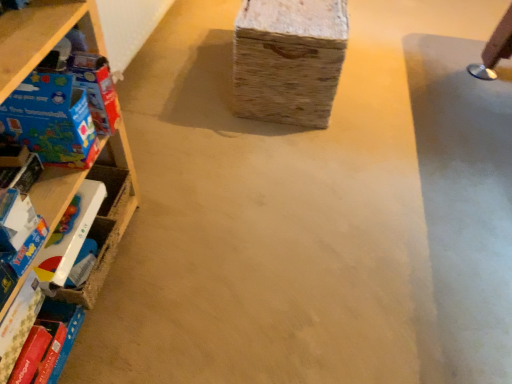
What do you see at coordinates (69, 235) in the screenshot? The height and width of the screenshot is (384, 512). I see `matte plastic toy at left, which ranks as the 4th toy in top-to-bottom order` at bounding box center [69, 235].

Locate an element on the screen. The width and height of the screenshot is (512, 384). hardcover book at lower left is located at coordinates (48, 344).

From a real-world perspective, which is physically below, matte plastic toy at left, positioned as the third toy in top-to-bottom order, or hardcover book at lower left?

hardcover book at lower left.

Is matte plastic toy at left, marked as the 2th toy in a bottom-to-top arrangement, located outside hardcover book at lower left?

That's correct, matte plastic toy at left, marked as the 2th toy in a bottom-to-top arrangement, is outside of hardcover book at lower left.

Can you confirm if matte plastic toy at left, marked as the 2th toy in a bottom-to-top arrangement, is thinner than hardcover book at lower left?

In fact, matte plastic toy at left, marked as the 2th toy in a bottom-to-top arrangement, might be wider than hardcover book at lower left.

Between matte plastic toy at left, positioned as the third toy in top-to-bottom order, and hardcover book at lower left, which one has larger size?

hardcover book at lower left.

Find the location of a particular element. This screenshot has width=512, height=384. the 3rd toy behind the hardcover book at lower left, starting your count from the anchor is located at coordinates (69, 235).

Based on the photo, from a real-world perspective, which is physically below, hardcover book at lower left or matte plastic toy at left, the first toy positioned from the bottom?

hardcover book at lower left.

Looking at this image, can you confirm if hardcover book at lower left is bigger than matte plastic toy at left, which ranks as the 4th toy in top-to-bottom order?

Correct, hardcover book at lower left is larger in size than matte plastic toy at left, which ranks as the 4th toy in top-to-bottom order.

Can you confirm if matte cardboard box at left, which ranks as the 3th toy in bottom-to-top order, is taller than matte plastic toy at left, which ranks as the 4th toy in top-to-bottom order?

Indeed, matte cardboard box at left, which ranks as the 3th toy in bottom-to-top order, has a greater height compared to matte plastic toy at left, which ranks as the 4th toy in top-to-bottom order.

Consider the image. Can you tell me how much matte cardboard box at left, the second toy when ordered from top to bottom, and matte plastic toy at left, which ranks as the 4th toy in top-to-bottom order, differ in facing direction?

The facing directions of matte cardboard box at left, the second toy when ordered from top to bottom, and matte plastic toy at left, which ranks as the 4th toy in top-to-bottom order, are 0.656 degrees apart.

Relative to matte plastic toy at left, which ranks as the 4th toy in top-to-bottom order, is matte cardboard box at left, the second toy when ordered from top to bottom, in front or behind?

Visually, matte cardboard box at left, the second toy when ordered from top to bottom, is located in front of matte plastic toy at left, which ranks as the 4th toy in top-to-bottom order.

Considering the sizes of wooden at left and white cardboard box at center in the image, is wooden at left wider or thinner than white cardboard box at center?

In the image, wooden at left appears to be more narrow than white cardboard box at center.

How distant is wooden at left from white cardboard box at center?

wooden at left and white cardboard box at center are 32.75 inches apart from each other.

Is wooden at left directly adjacent to white cardboard box at center?

No, wooden at left is not next to white cardboard box at center.

Which object is closer to the camera taking this photo, wooden at left or white cardboard box at center?

Positioned in front is wooden at left.

Is white cardboard box at center outside of wooden at left?

That's correct, white cardboard box at center is outside of wooden at left.

Find the location of a particular element. Image resolution: width=512 pixels, height=384 pixels. shelf on the left of white cardboard box at center is located at coordinates (41, 35).

Are white cardboard box at center and wooden at left located far from each other?

They are positioned close to each other.

Looking at this image, is white cardboard box at center to the left or to the right of wooden at left in the image?

Based on their positions, white cardboard box at center is located to the right of wooden at left.

From a real-world perspective, between wooden at left and matte plastic toy at left, which ranks as the 4th toy in top-to-bottom order, who is vertically lower?

matte plastic toy at left, which ranks as the 4th toy in top-to-bottom order, from a real-world perspective.

Is wooden at left taller than matte plastic toy at left, the first toy positioned from the bottom?

Indeed, wooden at left has a greater height compared to matte plastic toy at left, the first toy positioned from the bottom.

Is matte plastic toy at left, the first toy positioned from the bottom, completely or partially inside wooden at left?

Yes, matte plastic toy at left, the first toy positioned from the bottom, can be found within wooden at left.

In the scene shown: From the image's perspective, between wooden at left and blue cardboard box at left, the first toy when ordered from top to bottom, which one is located above?

blue cardboard box at left, the first toy when ordered from top to bottom, is shown above in the image.

From a real-world perspective, is wooden at left positioned over blue cardboard box at left, the first toy when ordered from top to bottom, based on gravity?

No, from a real-world perspective, wooden at left is not over blue cardboard box at left, the first toy when ordered from top to bottom

Can you tell me how much wooden at left and blue cardboard box at left, the 4th toy in the bottom-to-top sequence, differ in facing direction?

0.109 degrees separate the facing orientations of wooden at left and blue cardboard box at left, the 4th toy in the bottom-to-top sequence.

This screenshot has width=512, height=384. I want to click on book on the right of matte plastic toy at left, marked as the 2th toy in a bottom-to-top arrangement, so click(48, 344).

This screenshot has height=384, width=512. I want to click on book lying in front of the matte plastic toy at left, which ranks as the 4th toy in top-to-bottom order, so click(x=48, y=344).

Based on their spatial positions, is wooden at left or matte plastic toy at left, the first toy positioned from the bottom, further from matte plastic toy at left, marked as the 2th toy in a bottom-to-top arrangement?

wooden at left.

Considering their positions, is matte plastic toy at left, the first toy positioned from the bottom, positioned closer to hardcover book at lower left than matte plastic toy at left, positioned as the third toy in top-to-bottom order?

matte plastic toy at left, the first toy positioned from the bottom, is closer to hardcover book at lower left.

From the image, which object appears to be nearer to hardcover book at lower left, matte cardboard box at left, the second toy when ordered from top to bottom, or white cardboard box at center?

The object closer to hardcover book at lower left is matte cardboard box at left, the second toy when ordered from top to bottom.

Considering their positions, is matte plastic toy at left, which ranks as the 4th toy in top-to-bottom order, positioned closer to hardcover book at lower left than blue cardboard box at left, the 4th toy in the bottom-to-top sequence?

matte plastic toy at left, which ranks as the 4th toy in top-to-bottom order.

From the image, which object appears to be nearer to wooden at left, matte plastic toy at left, positioned as the third toy in top-to-bottom order, or matte plastic toy at left, the first toy positioned from the bottom?

matte plastic toy at left, the first toy positioned from the bottom, is positioned closer to the anchor wooden at left.

In the scene shown: Looking at the image, which one is located closer to blue cardboard box at left, the 4th toy in the bottom-to-top sequence, white cardboard box at center or matte cardboard box at left, the second toy when ordered from top to bottom?

matte cardboard box at left, the second toy when ordered from top to bottom, is positioned closer to the anchor blue cardboard box at left, the 4th toy in the bottom-to-top sequence.

From the image, which object appears to be farther from wooden at left, matte cardboard box at left, the second toy when ordered from top to bottom, or white cardboard box at center?

Based on the image, white cardboard box at center appears to be further to wooden at left.

Looking at the image, which one is located closer to matte plastic toy at left, marked as the 2th toy in a bottom-to-top arrangement, matte cardboard box at left, which ranks as the 3th toy in bottom-to-top order, or matte plastic toy at left, the first toy positioned from the bottom?

Based on the image, matte plastic toy at left, the first toy positioned from the bottom, appears to be nearer to matte plastic toy at left, marked as the 2th toy in a bottom-to-top arrangement.

Find the location of `toy situated between matte cardboard box at left, the second toy when ordered from top to bottom, and white cardboard box at center from left to right`. toy situated between matte cardboard box at left, the second toy when ordered from top to bottom, and white cardboard box at center from left to right is located at coordinates (86, 78).

The height and width of the screenshot is (384, 512). What are the coordinates of `toy between wooden at left and hardcover book at lower left from front to back` in the screenshot? It's located at (21, 231).

Locate an element on the screen. The width and height of the screenshot is (512, 384). shelf between matte cardboard box at left, which ranks as the 3th toy in bottom-to-top order, and hardcover book at lower left, in the vertical direction is located at coordinates (41, 35).

In order to click on toy between blue cardboard box at left, the 4th toy in the bottom-to-top sequence, and matte plastic toy at left, positioned as the third toy in top-to-bottom order, in the vertical direction in this screenshot , I will do `click(51, 120)`.